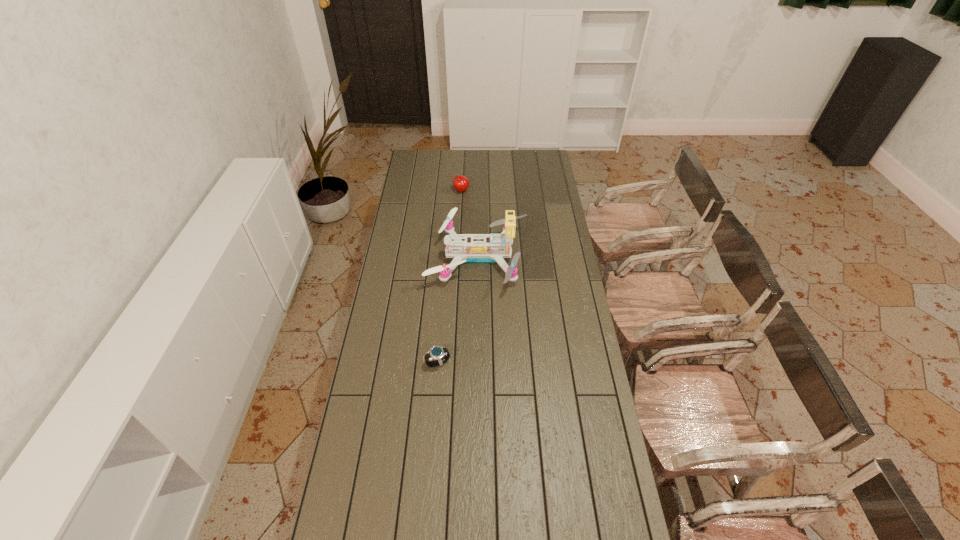
Locate an element on the screen. The image size is (960, 540). the second farthest object is located at coordinates (477, 251).

Find the location of `the tallest object`. the tallest object is located at coordinates (477, 251).

At what (x,y) coordinates should I click in order to perform the action: click on the second tallest object. Please return your answer as a coordinate pair (x, y). The image size is (960, 540). Looking at the image, I should click on (461, 183).

Locate an element on the screen. cherry is located at coordinates (461, 183).

Identify the location of the nearest object. (436, 352).

Where is `the shortest object`? Image resolution: width=960 pixels, height=540 pixels. the shortest object is located at coordinates (436, 352).

This screenshot has height=540, width=960. What are the coordinates of `vacant area situated on the left of the cherry` in the screenshot? It's located at (439, 191).

Locate an element on the screen. The height and width of the screenshot is (540, 960). vacant space located on the back of the nearest object is located at coordinates (444, 289).

At what (x,y) coordinates should I click in order to perform the action: click on vacant point at the far edge. Please return your answer as a coordinate pair (x, y). The width and height of the screenshot is (960, 540). Looking at the image, I should click on (440, 168).

I want to click on free space at the left edge of the desktop, so click(x=409, y=203).